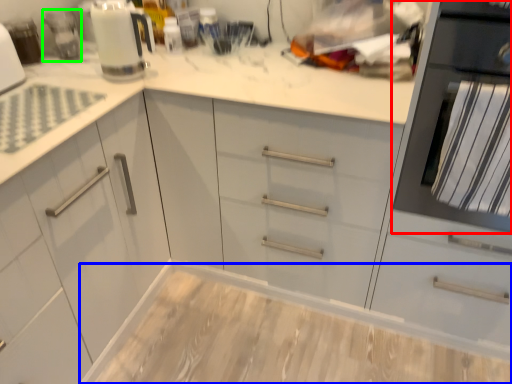
Question: Which object is the closest to the home appliance (highlighted by a red box)? Choose among these: counter (highlighted by a blue box) or appliance (highlighted by a green box).

Choices:
 (A) counter
 (B) appliance

Answer: (A)